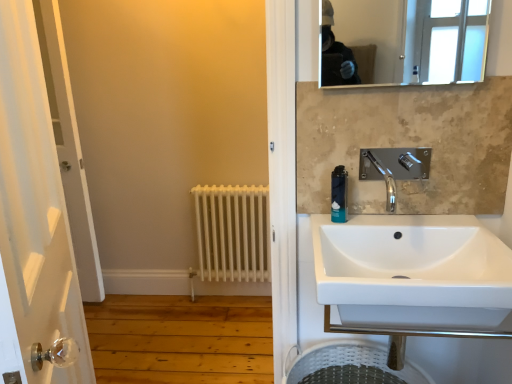
Question: Is clear glass mirror at upper center bigger than white ceramic sink at center?

Choices:
 (A) no
 (B) yes

Answer: (A)

Question: Is clear glass mirror at upper center shorter than white ceramic sink at center?

Choices:
 (A) no
 (B) yes

Answer: (B)

Question: From the image's perspective, does clear glass mirror at upper center appear lower than white ceramic sink at center?

Choices:
 (A) yes
 (B) no

Answer: (B)

Question: From a real-world perspective, is clear glass mirror at upper center positioned under white ceramic sink at center based on gravity?

Choices:
 (A) no
 (B) yes

Answer: (A)

Question: Could you tell me if clear glass mirror at upper center is turned towards white ceramic sink at center?

Choices:
 (A) no
 (B) yes

Answer: (A)

Question: Is clear glass mirror at upper center in front of or behind black plastic soap dispenser at upper right in the image?

Choices:
 (A) behind
 (B) front

Answer: (B)

Question: From the image's perspective, is clear glass mirror at upper center located above or below black plastic soap dispenser at upper right?

Choices:
 (A) above
 (B) below

Answer: (A)

Question: From a real-world perspective, is clear glass mirror at upper center physically located above or below black plastic soap dispenser at upper right?

Choices:
 (A) below
 (B) above

Answer: (B)

Question: Is clear glass mirror at upper center wider or thinner than black plastic soap dispenser at upper right?

Choices:
 (A) thin
 (B) wide

Answer: (A)

Question: Is clear glass mirror at upper center to the left or to the right of white ceramic sink at center in the image?

Choices:
 (A) left
 (B) right

Answer: (B)

Question: Is clear glass mirror at upper center wider or thinner than white ceramic sink at center?

Choices:
 (A) wide
 (B) thin

Answer: (B)

Question: Does point (419, 77) appear closer or farther from the camera than point (324, 268)?

Choices:
 (A) closer
 (B) farther

Answer: (B)

Question: From their relative heights in the image, would you say clear glass mirror at upper center is taller or shorter than white ceramic sink at center?

Choices:
 (A) short
 (B) tall

Answer: (A)

Question: Does point (337, 173) appear closer or farther from the camera than point (419, 274)?

Choices:
 (A) closer
 (B) farther

Answer: (B)

Question: In terms of size, does black plastic soap dispenser at upper right appear bigger or smaller than white ceramic sink at center?

Choices:
 (A) small
 (B) big

Answer: (A)